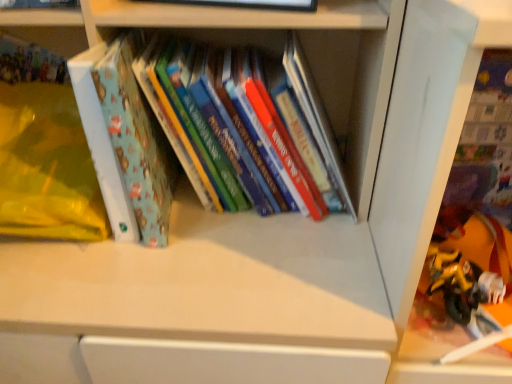
Question: Considering the positions of matte blue book at left and yellow matte toy at lower right in the image, is matte blue book at left bigger or smaller than yellow matte toy at lower right?

Choices:
 (A) small
 (B) big

Answer: (B)

Question: In the image, is matte blue book at left on the left side or the right side of yellow matte toy at lower right?

Choices:
 (A) right
 (B) left

Answer: (B)

Question: Estimate the real-world distances between objects in this image. Which object is farther from the yellow matte toy at lower right?

Choices:
 (A) transparent plastic toys at lower right
 (B) matte blue book at left
 (C) matte blue book at upper left, which is the 2th book from right to left
 (D) hardcover books at center, the 2th book when ordered from left to right

Answer: (C)

Question: Estimate the real-world distances between objects in this image. Which object is closer to the transparent plastic toys at lower right?

Choices:
 (A) yellow matte toy at lower right
 (B) matte blue book at left
 (C) hardcover books at center, the 1th book in the right-to-left sequence
 (D) matte blue book at upper left, the first book from the top

Answer: (A)